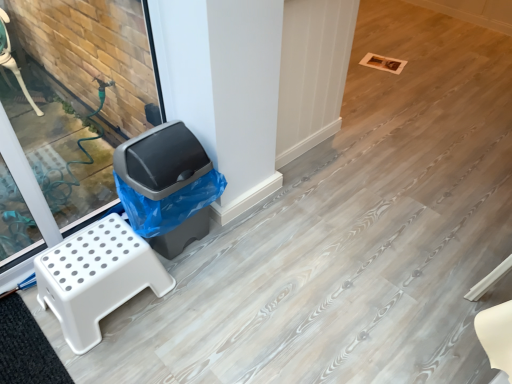
Where is `free space in front of gray plastic trash can at left`? Image resolution: width=512 pixels, height=384 pixels. free space in front of gray plastic trash can at left is located at coordinates (186, 302).